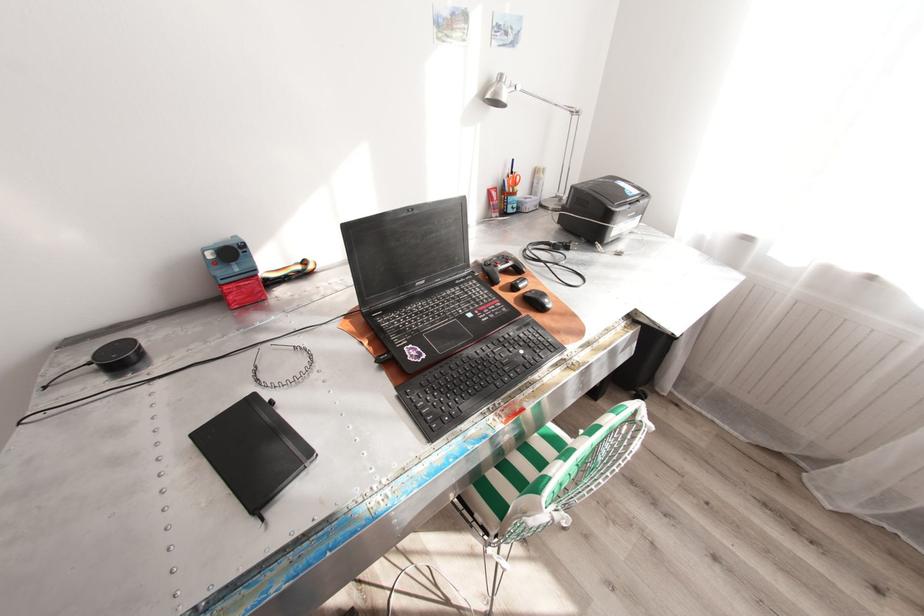
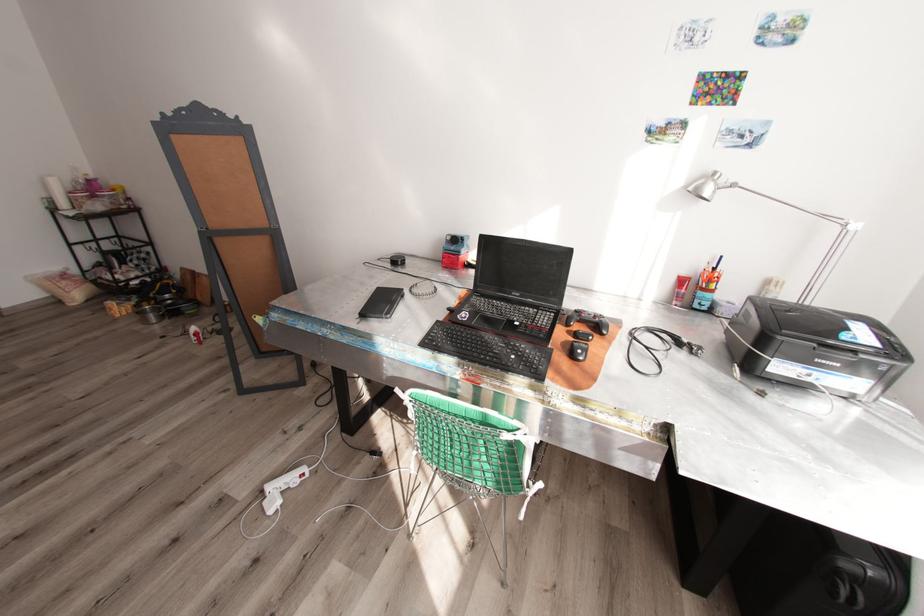
Find the pixel in the second image that matches [492,95] in the first image.

(695, 188)